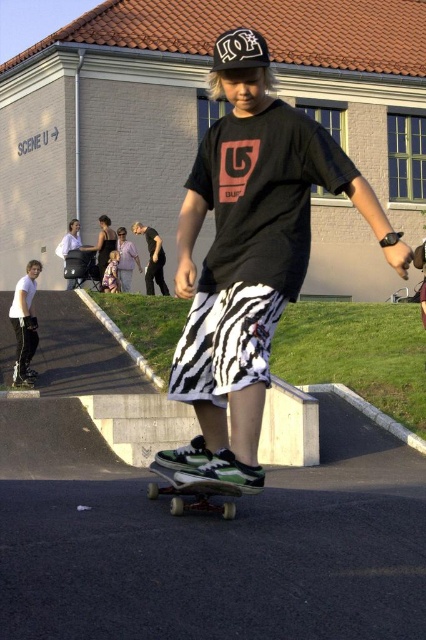
Between point (23, 337) and point (115, 280), which one is positioned in front?

Point (23, 337)

Where is `white matte pants at lower left`? This screenshot has width=426, height=640. white matte pants at lower left is located at coordinates (25, 324).

Does zebra-patterned shorts at center appear under white matte pants at lower left?

Incorrect, zebra-patterned shorts at center is not positioned below white matte pants at lower left.

Can you confirm if zebra-patterned shorts at center is positioned to the right of white matte pants at lower left?

Correct, you'll find zebra-patterned shorts at center to the right of white matte pants at lower left.

Does point (241, 218) come in front of point (14, 328)?

Yes, point (241, 218) is closer to viewer.

The height and width of the screenshot is (640, 426). I want to click on zebra-patterned shorts at center, so click(x=250, y=256).

Which of these two, white matte pants at lower left or green matte skateboard at center, stands shorter?

green matte skateboard at center

Can you confirm if white matte pants at lower left is bigger than green matte skateboard at center?

Correct, white matte pants at lower left is larger in size than green matte skateboard at center.

What are the coordinates of `white matte pants at lower left` in the screenshot? It's located at 25,324.